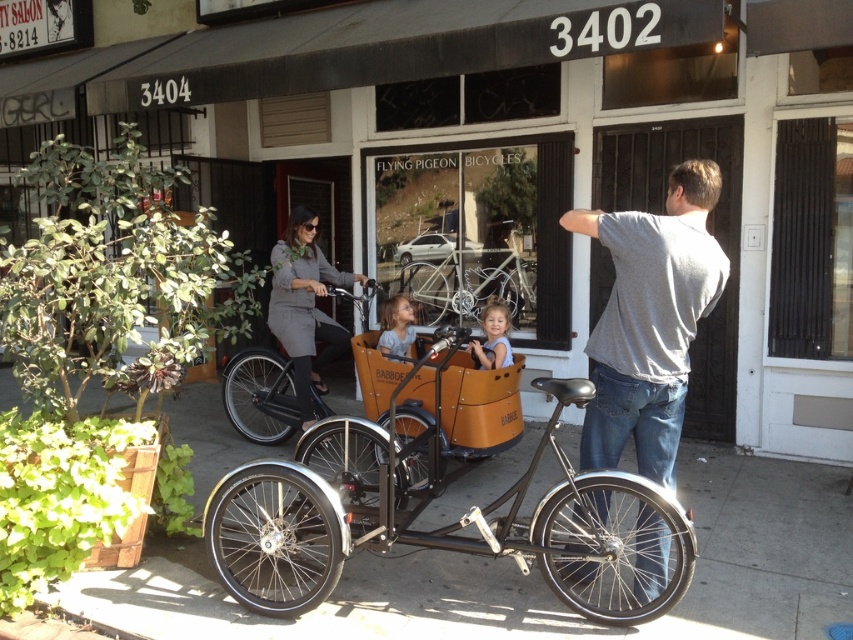
You are standing at the entrance of the Flying Pigeon Bicycles store at 3402. You see a point marked at coordinates (498, 150). Based on the scene, can you tell me what object this point is located on?

The point at coordinates (498, 150) is located on the wooden cargo bike at center.

You are a delivery person who needs to place a gray matte dress at center into a storage locker. The locker has a height limit of 1 meter. Can the wooden cargo bike at center, which is currently blocking the locker entrance, be moved aside without disassembling it?

The wooden cargo bike at center is located above gray matte dress at center, so the dress is underneath the bike. To access the dress, you would need to move the wooden cargo bike at center first. However, since the bike is blocking the locker entrance, moving it aside would allow access to the dress for storage. The height of the bike isn not mentioned, so we can not confirm if it fits the locker height limit.